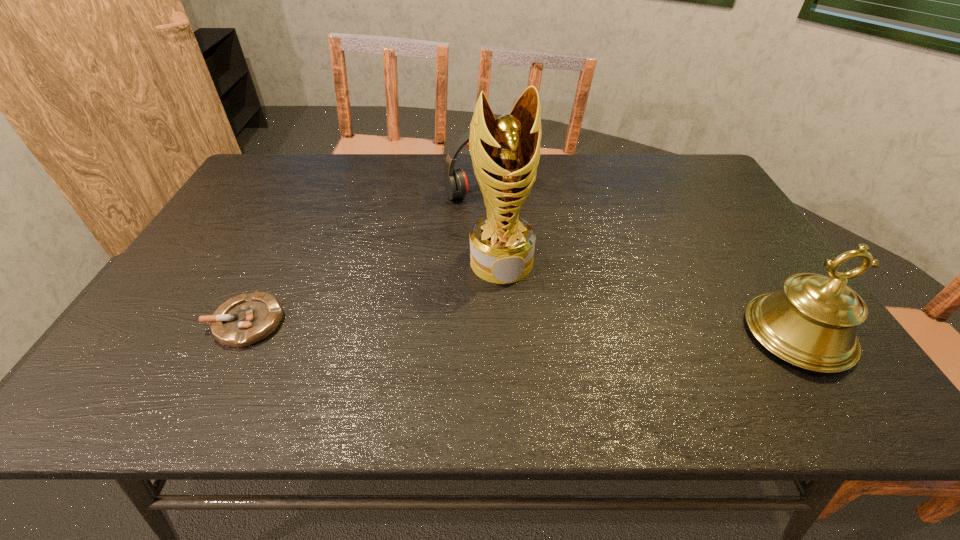
The width and height of the screenshot is (960, 540). Identify the location of vacant space located on the ear cups of the earphone. click(x=551, y=269).

The image size is (960, 540). I want to click on vacant space located 0.360m on the ear cups of the earphone, so click(x=561, y=281).

At what (x,y) coordinates should I click in order to perform the action: click on vacant space located 0.400m on the ear cups of the earphone. Please return your answer as a coordinate pair (x, y). The width and height of the screenshot is (960, 540). Looking at the image, I should click on (569, 292).

Locate an element on the screen. free space located on the front-facing side of the award is located at coordinates (x=530, y=352).

You are a GUI agent. You are given a task and a screenshot of the screen. Output one action in this format:
    pyautogui.click(x=<x>, y=<y>)
    Task: Click on the free space located 0.180m on the front-facing side of the award
    
    Given the screenshot: What is the action you would take?
    pyautogui.click(x=526, y=341)

Image resolution: width=960 pixels, height=540 pixels. What are the coordinates of `vacant space located 0.140m on the front-facing side of the award` in the screenshot? It's located at pos(522,327).

Locate an element on the screen. This screenshot has width=960, height=540. object that is positioned at the far edge is located at coordinates (455, 180).

The image size is (960, 540). Find the location of `ashtray situated at the near edge`. ashtray situated at the near edge is located at coordinates (246, 319).

At what (x,y) coordinates should I click in order to perform the action: click on bell that is at the near edge. Please return your answer as a coordinate pair (x, y). This screenshot has width=960, height=540. Looking at the image, I should click on (811, 323).

You are a GUI agent. You are given a task and a screenshot of the screen. Output one action in this format:
    pyautogui.click(x=<x>, y=<y>)
    Task: Click on the object positioned at the left edge
    The image size is (960, 540).
    Given the screenshot: What is the action you would take?
    pyautogui.click(x=246, y=319)